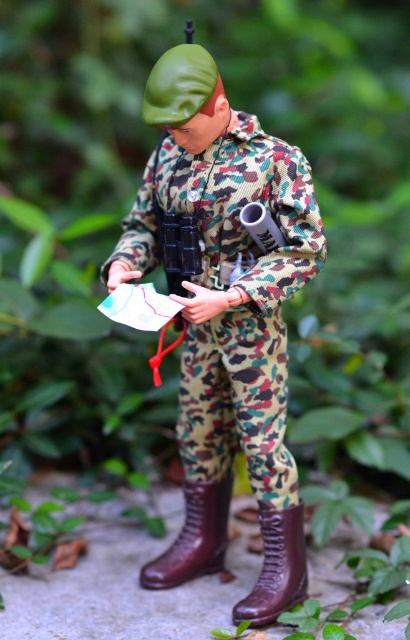
Is camo fabric uniform at center further to camera compared to leather at center?

No, it is not.

Who is more distant from viewer, (166, 132) or (298, 532)?

The point (166, 132) is more distant.

Where is `camo fabric uniform at center`? The image size is (410, 640). camo fabric uniform at center is located at coordinates coord(225,316).

Can you confirm if camo fabric uniform at center is positioned to the left of brown leather boot at lower center?

No, camo fabric uniform at center is not to the left of brown leather boot at lower center.

Between point (268, 618) and point (186, 525), which one is positioned in front?

Point (268, 618) is in front.

The width and height of the screenshot is (410, 640). In order to click on camo fabric uniform at center in this screenshot , I will do `click(225, 316)`.

Is point (220, 563) behind point (287, 529)?

That is True.

Is brown leather boot at lower center smaller than leather at center?

No.

What do you see at coordinates (195, 538) in the screenshot?
I see `brown leather boot at lower center` at bounding box center [195, 538].

You are a GUI agent. You are given a task and a screenshot of the screen. Output one action in this format:
    pyautogui.click(x=<x>, y=<y>)
    Task: Click on the brown leather boot at lower center
    The image size is (410, 640).
    Given the screenshot: What is the action you would take?
    pyautogui.click(x=195, y=538)